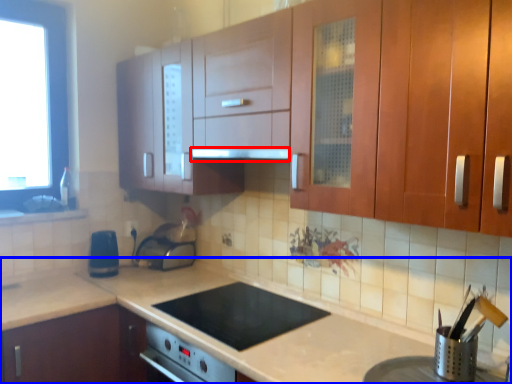
Question: Which of the following is the farthest to the observer, exhaust hood (highlighted by a red box) or countertop (highlighted by a blue box)?

Choices:
 (A) exhaust hood
 (B) countertop

Answer: (A)